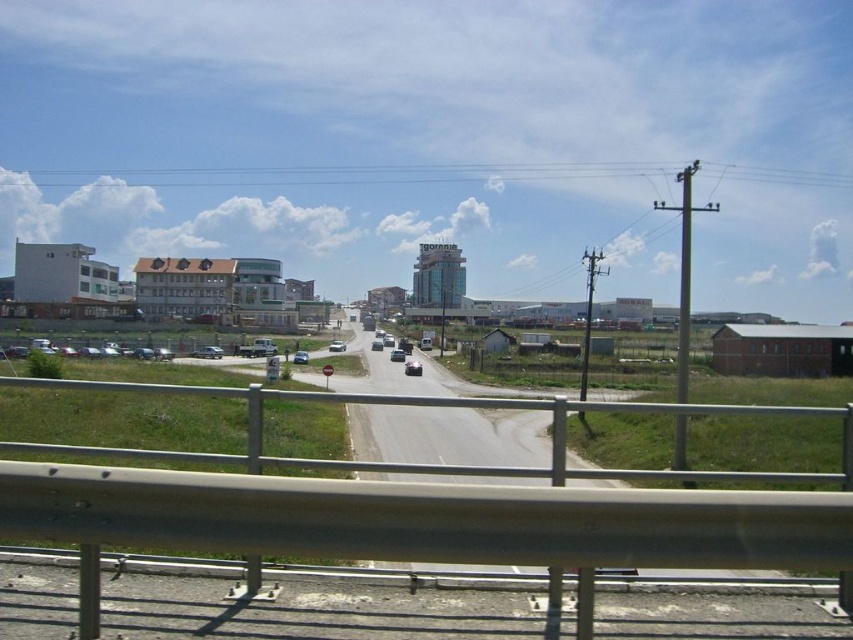
Question: Which of the following is the closest to the observer?

Choices:
 (A) (399, 356)
 (B) (415, 362)
 (C) (329, 348)
 (D) (305, 355)

Answer: (D)

Question: Which of the following is the farthest from the observer?

Choices:
 (A) silver metallic sedan at center-left
 (B) silver metallic sedan at center

Answer: (B)

Question: Is shiny silver car at center to the right of metallic silver car at center from the viewer's perspective?

Choices:
 (A) no
 (B) yes

Answer: (B)

Question: Can you confirm if shiny silver car at center is bigger than silver metallic sedan at center?

Choices:
 (A) no
 (B) yes

Answer: (A)

Question: Does silver metallic sedan at center appear under shiny silver sedan at center?

Choices:
 (A) no
 (B) yes

Answer: (A)

Question: Which of the following is the closest to the observer?

Choices:
 (A) (305, 358)
 (B) (207, 346)
 (C) (341, 342)
 (D) (421, 372)

Answer: (D)